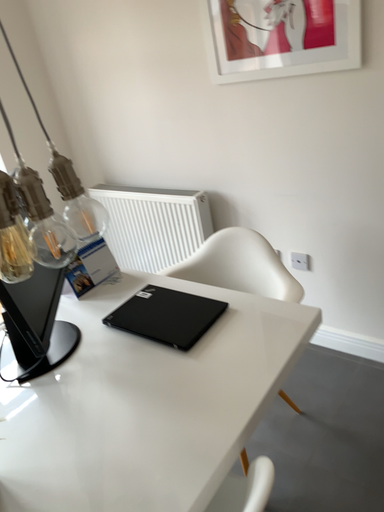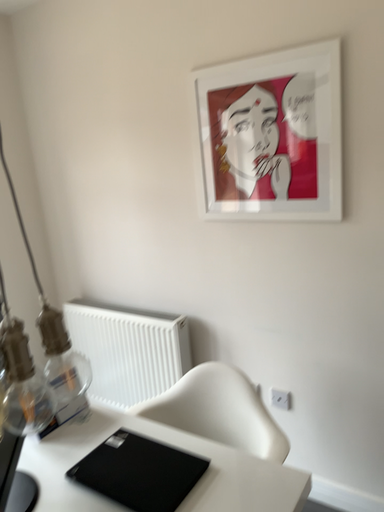
Question: Which way did the camera rotate in the video?

Choices:
 (A) rotated downward
 (B) rotated upward

Answer: (B)